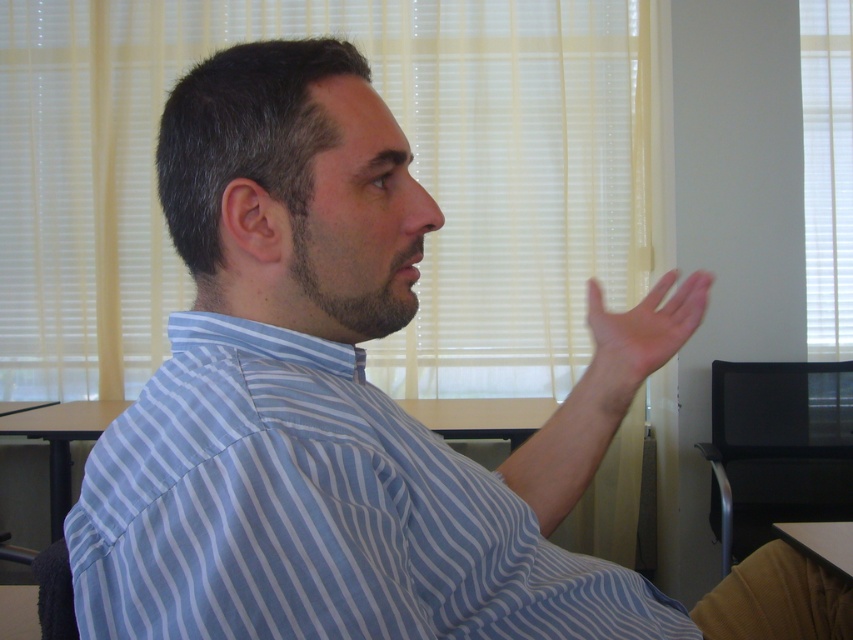
Is blue striped shirt at center to the right of black plastic table at lower right from the viewer's perspective?

In fact, blue striped shirt at center is to the left of black plastic table at lower right.

Does blue striped shirt at center have a larger size compared to black plastic table at lower right?

Yes.

Does point (392, 612) come closer to viewer compared to point (815, 538)?

Yes, point (392, 612) is closer to viewer.

Identify the location of blue striped shirt at center. (318, 404).

Who is taller, blue striped shirt at center or brown wooden desk at lower left?

blue striped shirt at center is taller.

Between blue striped shirt at center and brown wooden desk at lower left, which one is positioned higher?

blue striped shirt at center is above.

Between point (165, 449) and point (61, 429), which one is positioned behind?

The point (61, 429) is behind.

Where is `blue striped shirt at center`? Image resolution: width=853 pixels, height=640 pixels. blue striped shirt at center is located at coordinates (318, 404).

Can you confirm if brown wooden desk at lower left is wider than black plastic table at lower right?

Yes, brown wooden desk at lower left is wider than black plastic table at lower right.

The height and width of the screenshot is (640, 853). I want to click on brown wooden desk at lower left, so click(x=61, y=442).

Consider the image. Who is more distant from viewer, (54, 467) or (773, 525)?

Point (54, 467)

This screenshot has width=853, height=640. Identify the location of brown wooden desk at lower left. (61, 442).